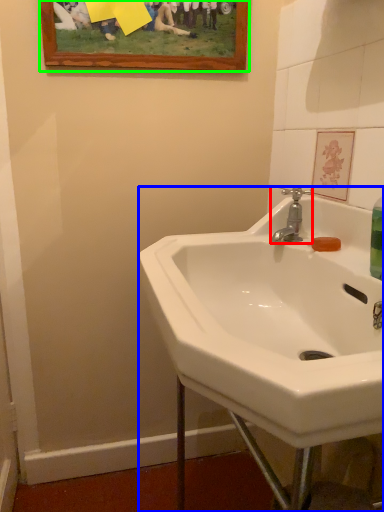
Question: Estimate the real-world distances between objects in this image. Which object is closer to tap (highlighted by a red box), sink (highlighted by a blue box) or picture frame (highlighted by a green box)?

Choices:
 (A) sink
 (B) picture frame

Answer: (A)